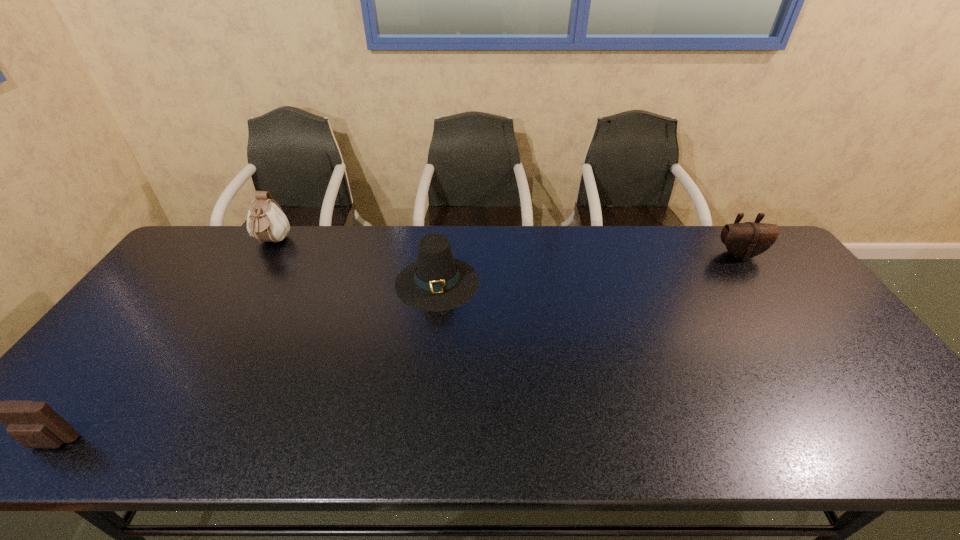
This screenshot has height=540, width=960. I want to click on object at the near edge, so click(33, 424).

The image size is (960, 540). I want to click on object that is at the left edge, so click(x=33, y=424).

I want to click on object at the right edge, so click(745, 240).

Where is `object positioned at the near left corner`? The image size is (960, 540). object positioned at the near left corner is located at coordinates pos(33,424).

This screenshot has width=960, height=540. I want to click on object present at the far right corner, so click(x=745, y=240).

At what (x,y) coordinates should I click in order to perform the action: click on vacant point at the far edge. Please return your answer as a coordinate pair (x, y). This screenshot has height=540, width=960. Looking at the image, I should click on (365, 241).

In the image, there is a desktop. Where is `vacant space at the near edge`? vacant space at the near edge is located at coordinates click(x=264, y=449).

This screenshot has height=540, width=960. In order to click on vacant area at the left edge of the desktop in this screenshot , I will do `click(117, 360)`.

The width and height of the screenshot is (960, 540). Find the location of `free space at the right edge`. free space at the right edge is located at coordinates (793, 307).

Where is `free area in between the hat and the rightmost pouch`? This screenshot has height=540, width=960. free area in between the hat and the rightmost pouch is located at coordinates (588, 268).